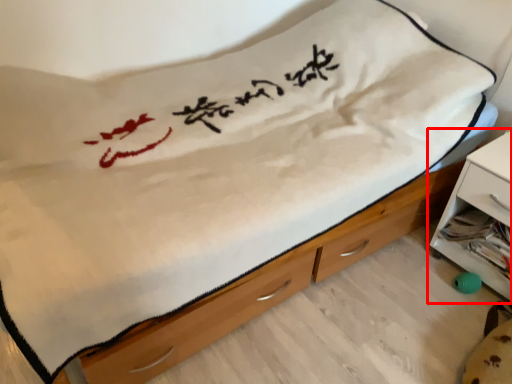
Question: From the image's perspective, where is nightstand (annotated by the red box) located relative to chest of drawers?

Choices:
 (A) below
 (B) above

Answer: (B)